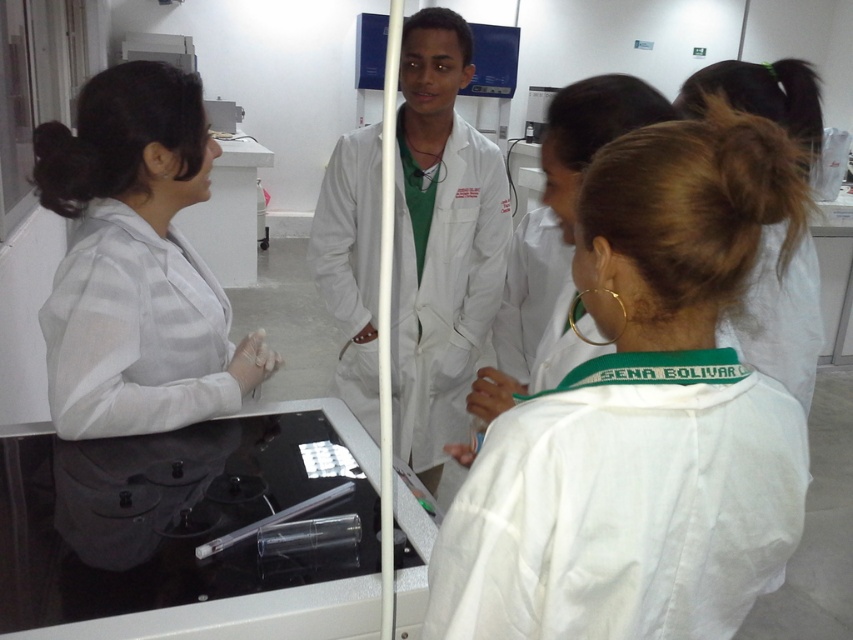
Question: Which of the following is the farthest from the observer?

Choices:
 (A) white matte lab coat at center
 (B) black glass tray at lower left

Answer: (B)

Question: Which point is farther to the camera?

Choices:
 (A) white fabric shirt at left
 (B) white lab coat at center
 (C) white matte lab coat at center
 (D) black glass tray at lower left

Answer: (B)

Question: Does black glass tray at lower left have a larger size compared to white lab coat at center?

Choices:
 (A) yes
 (B) no

Answer: (B)

Question: Is black glass tray at lower left positioned behind white lab coat at center?

Choices:
 (A) yes
 (B) no

Answer: (B)

Question: Which point is farther from the camera taking this photo?

Choices:
 (A) (428, 97)
 (B) (228, 618)
 (C) (88, 257)

Answer: (A)

Question: Can you confirm if white matte lab coat at center is bigger than white fabric shirt at left?

Choices:
 (A) yes
 (B) no

Answer: (B)